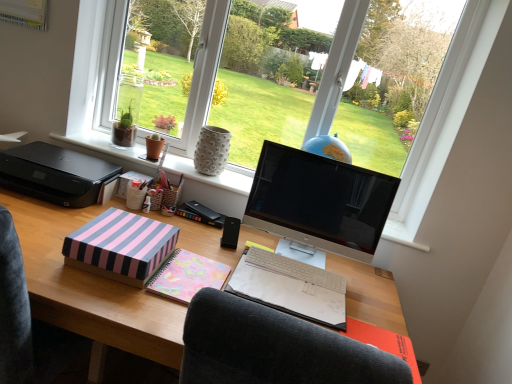
Question: Considering the relative sizes of pastel floral notebook at center and black plastic printer at left in the image provided, is pastel floral notebook at center taller than black plastic printer at left?

Choices:
 (A) yes
 (B) no

Answer: (B)

Question: Is pastel floral notebook at center facing away from black plastic printer at left?

Choices:
 (A) no
 (B) yes

Answer: (A)

Question: Considering the relative sizes of pastel floral notebook at center and black plastic printer at left in the image provided, is pastel floral notebook at center thinner than black plastic printer at left?

Choices:
 (A) yes
 (B) no

Answer: (A)

Question: Could you tell me if pastel floral notebook at center is turned towards black plastic printer at left?

Choices:
 (A) yes
 (B) no

Answer: (B)

Question: From the image's perspective, is pastel floral notebook at center below black plastic printer at left?

Choices:
 (A) yes
 (B) no

Answer: (A)

Question: From their relative heights in the image, would you say black plastic printer at left is taller or shorter than pink striped paper at center?

Choices:
 (A) tall
 (B) short

Answer: (A)

Question: Is black plastic printer at left bigger or smaller than pink striped paper at center?

Choices:
 (A) big
 (B) small

Answer: (A)

Question: From the image's perspective, is black plastic printer at left above or below pink striped paper at center?

Choices:
 (A) below
 (B) above

Answer: (B)

Question: In the image, is black plastic printer at left positioned in front of or behind pink striped paper at center?

Choices:
 (A) front
 (B) behind

Answer: (A)

Question: From a real-world perspective, is wooden desk at center positioned above or below sleek black monitor at center?

Choices:
 (A) below
 (B) above

Answer: (A)

Question: Considering the positions of wooden desk at center and sleek black monitor at center in the image, is wooden desk at center wider or thinner than sleek black monitor at center?

Choices:
 (A) wide
 (B) thin

Answer: (A)

Question: Based on their sizes in the image, would you say wooden desk at center is bigger or smaller than sleek black monitor at center?

Choices:
 (A) big
 (B) small

Answer: (A)

Question: Is wooden desk at center inside or outside of sleek black monitor at center?

Choices:
 (A) inside
 (B) outside

Answer: (B)

Question: Is pastel pink paper at lower right to the left or to the right of black plastic speaker at center in the image?

Choices:
 (A) left
 (B) right

Answer: (B)

Question: Based on their sizes in the image, would you say pastel pink paper at lower right is bigger or smaller than black plastic speaker at center?

Choices:
 (A) small
 (B) big

Answer: (B)